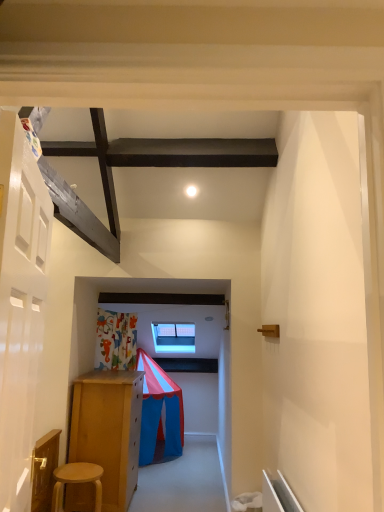
Question: Would you say white glossy light at upper center is to the left or to the right of white glossy door at left in the picture?

Choices:
 (A) left
 (B) right

Answer: (B)

Question: Is white glossy light at upper center in front of or behind white glossy door at left in the image?

Choices:
 (A) behind
 (B) front

Answer: (A)

Question: Based on their relative distances, which object is nearer to the light brown wooden stool at lower left?

Choices:
 (A) white glossy door at left
 (B) white glossy light at upper center

Answer: (A)

Question: Estimate the real-world distances between objects in this image. Which object is closer to the white glossy door at left?

Choices:
 (A) light brown wooden stool at lower left
 (B) white glossy light at upper center

Answer: (A)